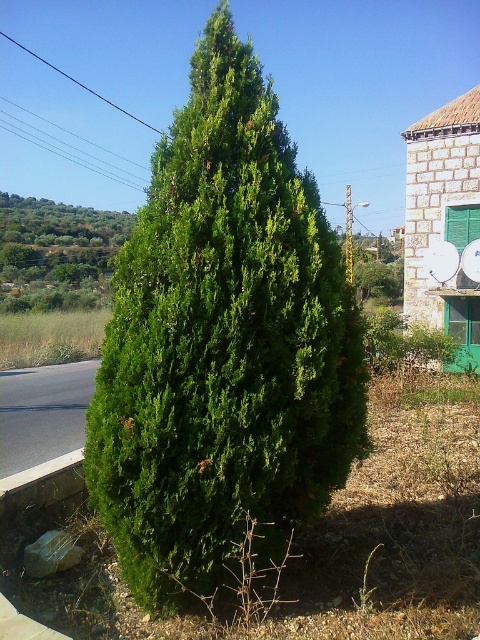
Which is behind, point (71, 259) or point (19, 499)?

The point (71, 259) is more distant.

At what (x,y) coordinates should I click in order to perform the action: click on green leafy tree at upper left. Please return your answer as a coordinate pair (x, y). Looking at the image, I should click on (57, 253).

Between green leafy shrub at center and green leafy tree at upper left, which one is positioned higher?

green leafy tree at upper left is higher up.

Does green leafy shrub at center appear on the left side of green leafy tree at upper left?

Incorrect, green leafy shrub at center is not on the left side of green leafy tree at upper left.

This screenshot has height=640, width=480. Find the location of `green leafy shrub at center`. green leafy shrub at center is located at coordinates (223, 344).

Locate an element on the screen. This screenshot has height=640, width=480. green leafy shrub at center is located at coordinates (223, 344).

Between green leafy shrub at center and gray concrete curb at lower left, which one has less height?

With less height is gray concrete curb at lower left.

You are a GUI agent. You are given a task and a screenshot of the screen. Output one action in this format:
    pyautogui.click(x=<x>, y=<y>)
    Task: Click on the green leafy shrub at center
    
    Given the screenshot: What is the action you would take?
    pyautogui.click(x=223, y=344)

Where is `green leafy shrub at center`? This screenshot has height=640, width=480. green leafy shrub at center is located at coordinates (223, 344).